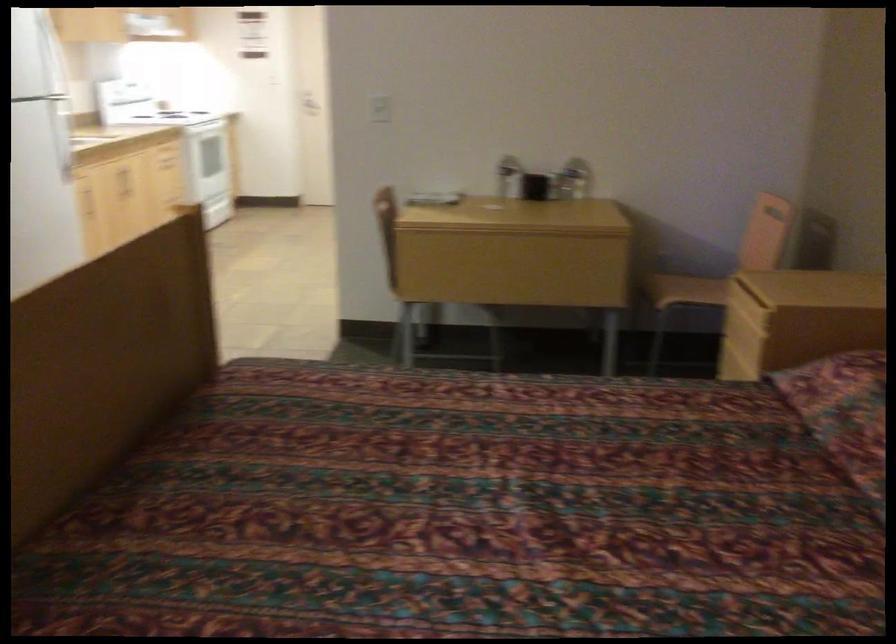
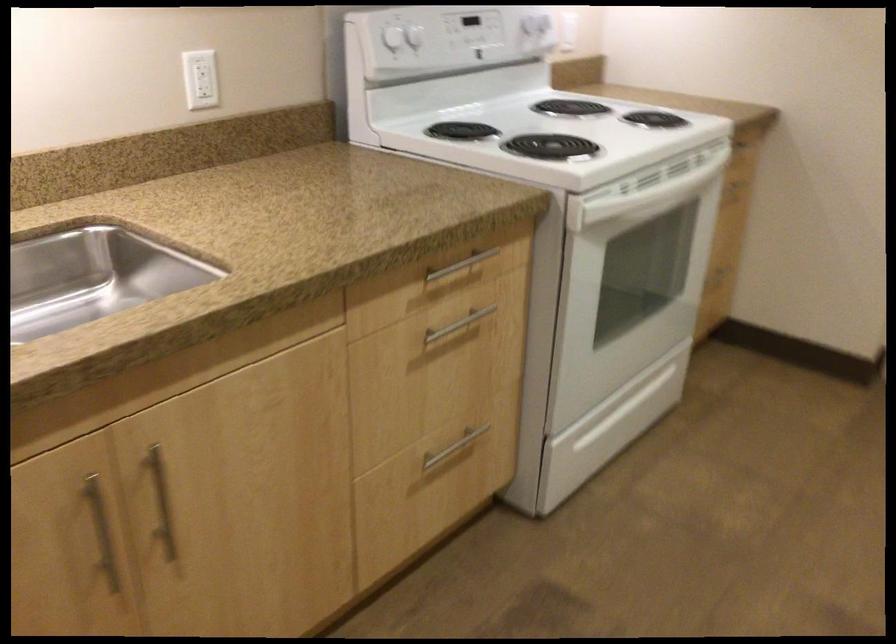
Locate, in the second image, the point that corresponds to (128,82) in the first image.

(414, 37)